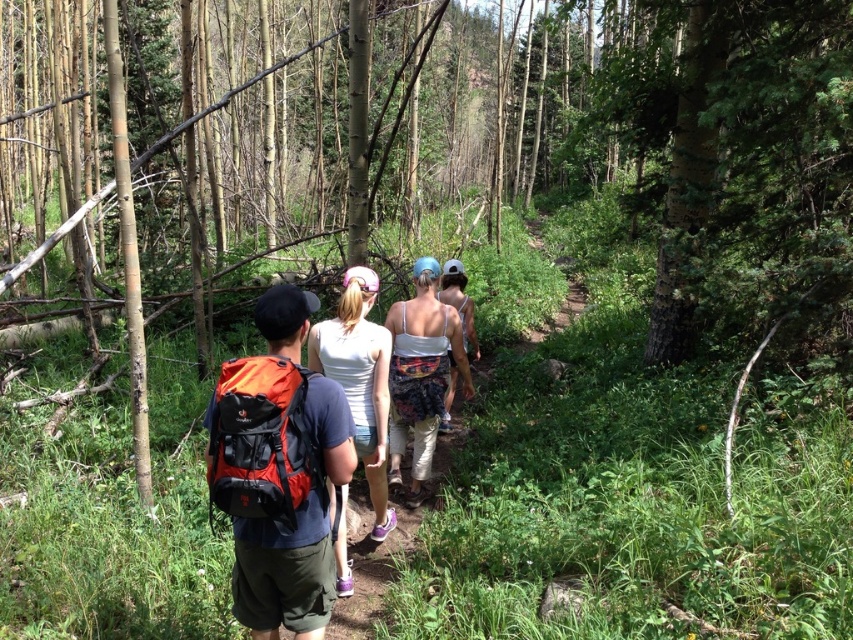
Question: Does floral fabric tank top at center have a larger size compared to white floral dress at center?

Choices:
 (A) no
 (B) yes

Answer: (B)

Question: Considering the real-world distances, which object is farthest from the white floral dress at center?

Choices:
 (A) floral fabric tank top at center
 (B) white fabric tank top at center
 (C) orange fabric backpack at center

Answer: (C)

Question: Which of the following is the closest to the observer?

Choices:
 (A) orange fabric backpack at center
 (B) floral fabric tank top at center
 (C) white fabric tank top at center

Answer: (A)

Question: Which point appears closest to the camera in this image?

Choices:
 (A) (440, 353)
 (B) (453, 259)

Answer: (A)

Question: Is the position of white fabric tank top at center less distant than that of white floral dress at center?

Choices:
 (A) yes
 (B) no

Answer: (A)

Question: Is white fabric tank top at center closer to the viewer compared to white floral dress at center?

Choices:
 (A) no
 (B) yes

Answer: (B)